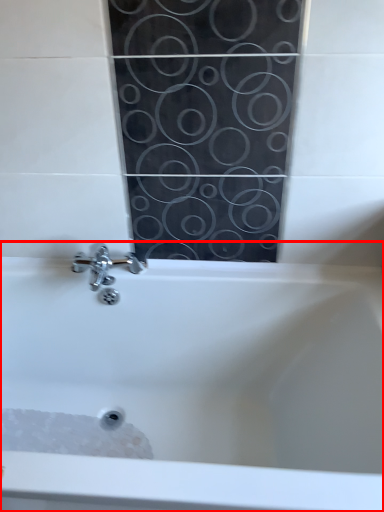
Question: Considering the relative positions of bathtub (annotated by the red box) and foam in the image provided, where is bathtub (annotated by the red box) located with respect to the staircase?

Choices:
 (A) left
 (B) right

Answer: (B)